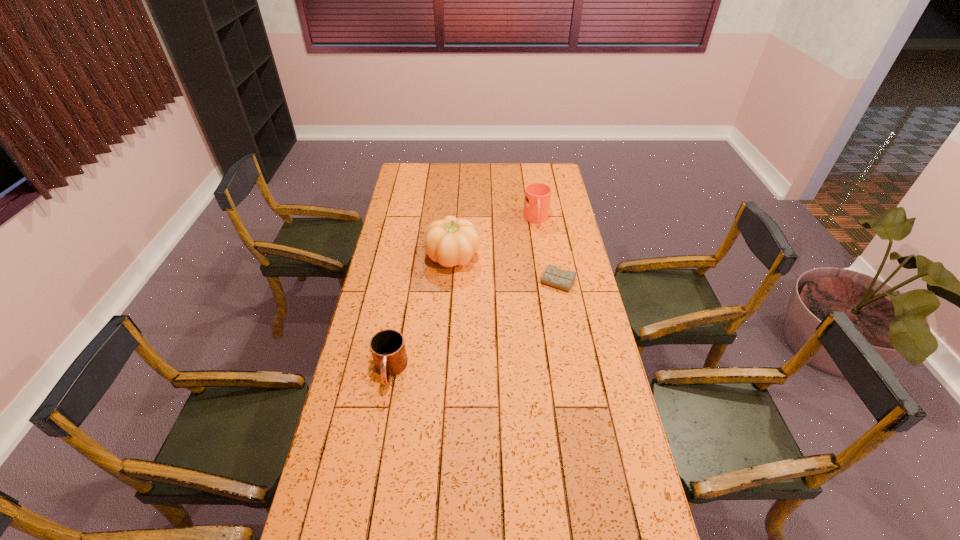
You are a GUI agent. You are given a task and a screenshot of the screen. Output one action in this format:
    pyautogui.click(x=<x>, y=<y>)
    Task: Click on the pumpkin
    
    Given the screenshot: What is the action you would take?
    pyautogui.click(x=450, y=241)

Where is `the second object from left to right`? the second object from left to right is located at coordinates (450, 241).

The image size is (960, 540). Identify the location of the second tallest object. (537, 198).

What are the coordinates of `the taller mug` in the screenshot? It's located at (537, 198).

This screenshot has width=960, height=540. Identify the location of the third tallest object. (388, 350).

At what (x,y) coordinates should I click in order to perform the action: click on the leftmost object. Please return your answer as a coordinate pair (x, y). Image resolution: width=960 pixels, height=540 pixels. Looking at the image, I should click on (388, 350).

This screenshot has height=540, width=960. Identify the location of diary. coord(553,276).

At what (x,y) coordinates should I click in order to perform the action: click on free region located 0.100m on the right of the pumpkin. Please return your answer as a coordinate pair (x, y). The image size is (960, 540). Looking at the image, I should click on tap(502, 256).

The height and width of the screenshot is (540, 960). I want to click on free space located on the handle side of the farthest object, so click(x=540, y=242).

Find the location of a particular element. free space located 0.270m on the side of the left mug with the handle is located at coordinates 372,476.